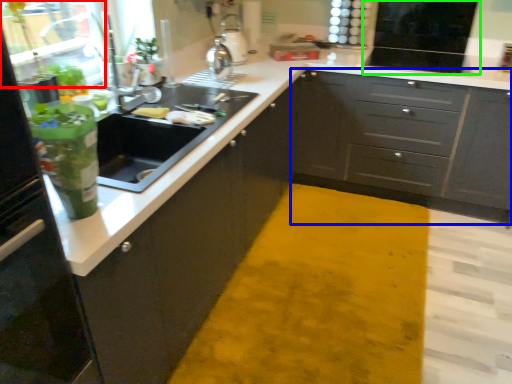
Question: Based on their relative distances, which object is farther from glass door (highlighted by a red box)? Choose from cabinetry (highlighted by a blue box) and appliance (highlighted by a green box).

Choices:
 (A) cabinetry
 (B) appliance

Answer: (B)